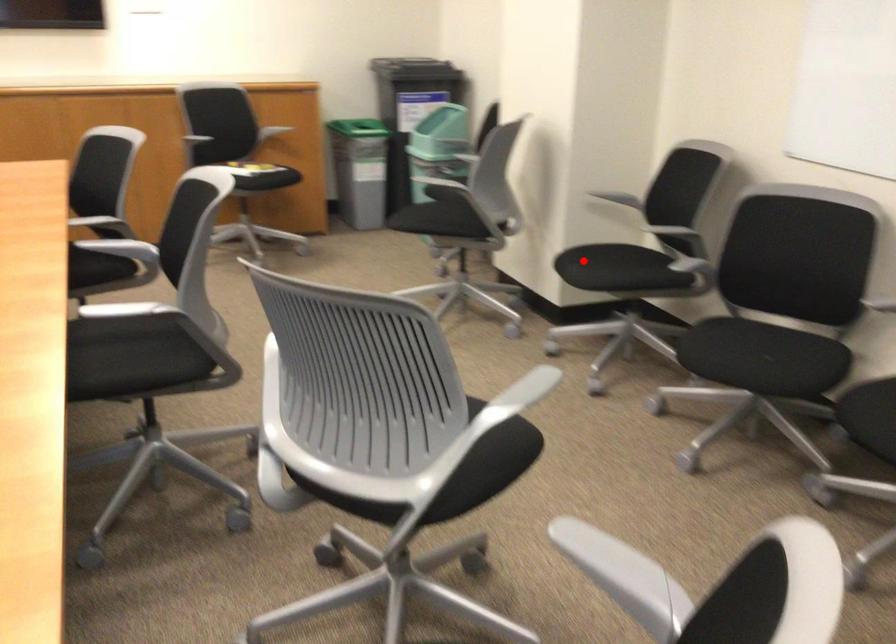
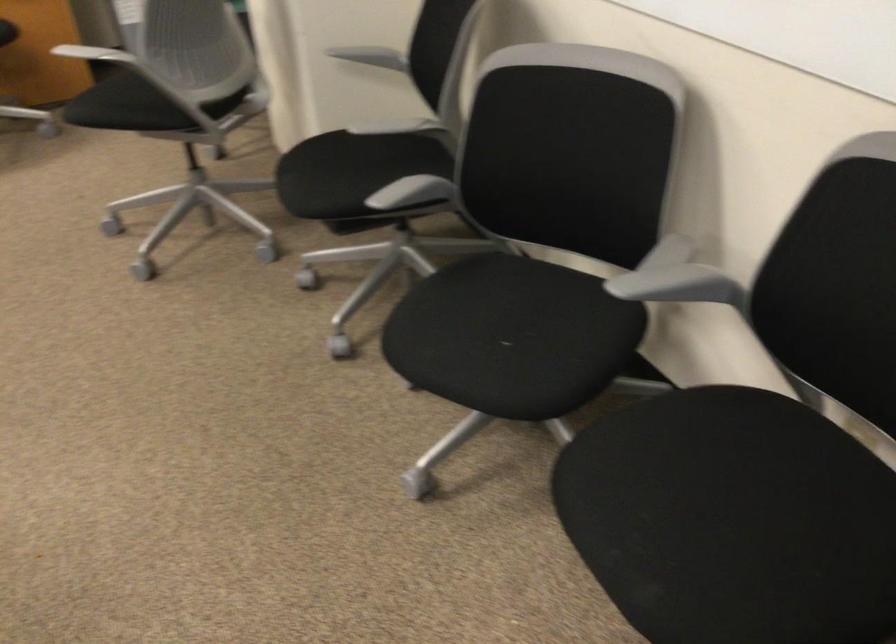
Question: I am providing you with two images of the same scene from different viewpoints. A red point is shown in image1. For the corresponding object point in image2, is it positioned nearer or farther from the camera?

Choices:
 (A) Nearer
 (B) Farther

Answer: (A)